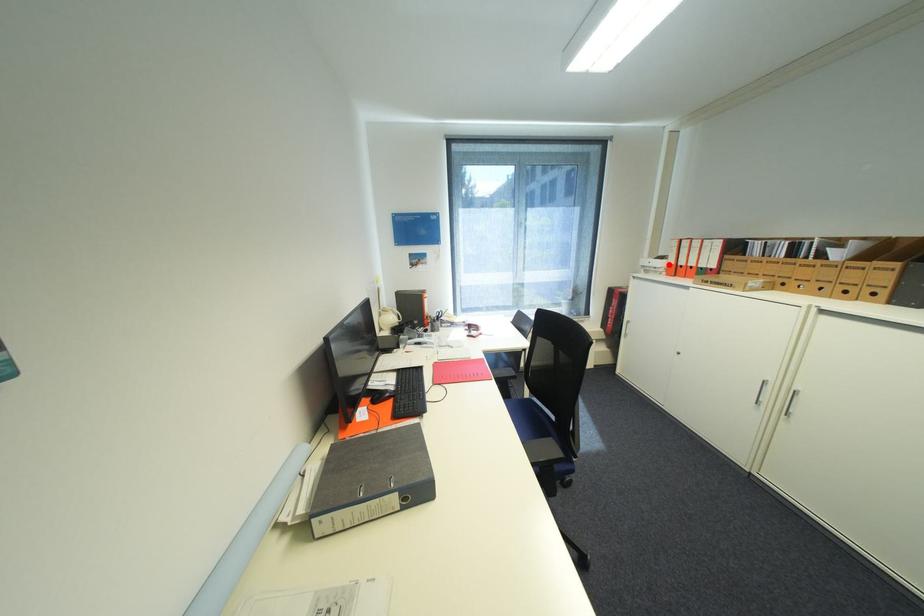
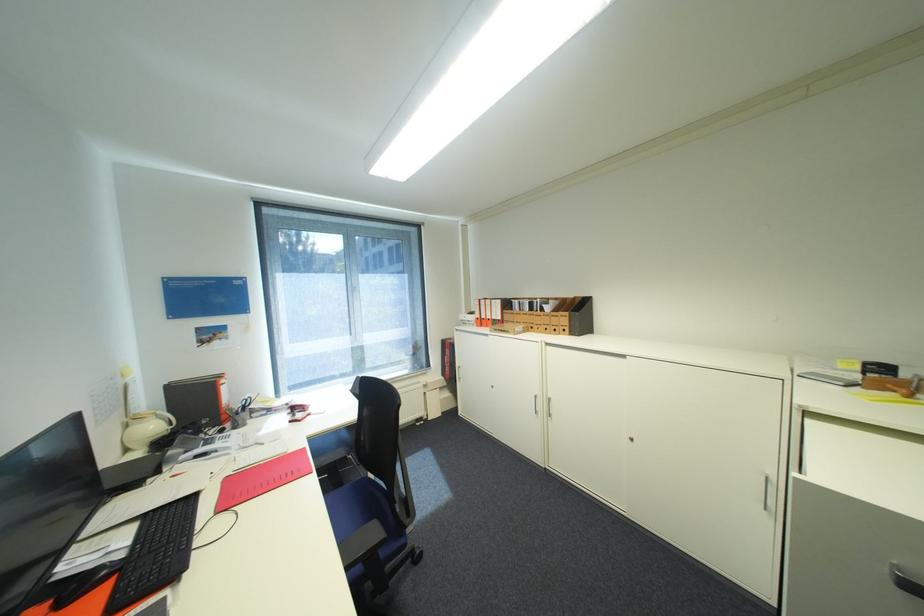
Question: I am providing you with two images of the same scene from different viewpoints. A red point is shown in image1. For the corresponding object point in image2, is it positioned nearer or farther from the camera?

Choices:
 (A) Nearer
 (B) Farther

Answer: (B)